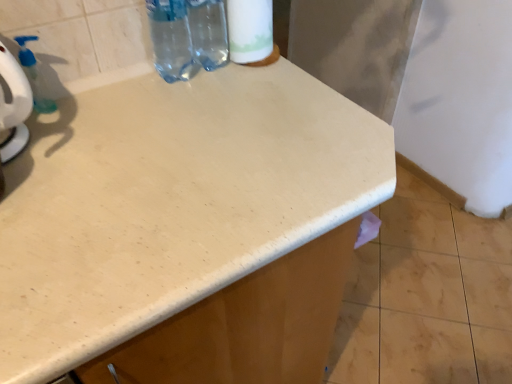
Image resolution: width=512 pixels, height=384 pixels. I want to click on vacant space that is in between transparent plastic bottle at upper center, which is counted as the 1th bottle, starting from the right, and transparent plastic soap dispenser at upper left, so click(113, 92).